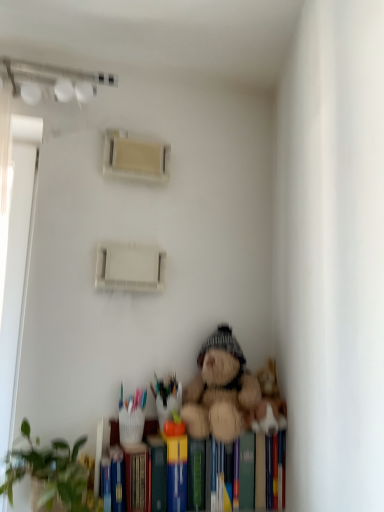
Question: Can you confirm if fuzzy brown teddy bear at lower center is bigger than hardcover book at lower center?

Choices:
 (A) yes
 (B) no

Answer: (A)

Question: From a real-world perspective, is fuzzy brown teddy bear at lower center physically below hardcover book at lower center?

Choices:
 (A) yes
 (B) no

Answer: (B)

Question: Is the surface of fuzzy brown teddy bear at lower center in direct contact with hardcover book at lower center?

Choices:
 (A) no
 (B) yes

Answer: (A)

Question: Is fuzzy brown teddy bear at lower center facing away from hardcover book at lower center?

Choices:
 (A) no
 (B) yes

Answer: (A)

Question: Is fuzzy brown teddy bear at lower center facing towards hardcover book at lower center?

Choices:
 (A) no
 (B) yes

Answer: (A)

Question: From a real-world perspective, is fuzzy brown teddy bear at lower center above or below hardcover book at lower center?

Choices:
 (A) above
 (B) below

Answer: (A)

Question: In terms of width, does fuzzy brown teddy bear at lower center look wider or thinner when compared to hardcover book at lower center?

Choices:
 (A) wide
 (B) thin

Answer: (A)

Question: Is fuzzy brown teddy bear at lower center in front of or behind hardcover book at lower center in the image?

Choices:
 (A) behind
 (B) front

Answer: (B)

Question: Based on their positions, is fuzzy brown teddy bear at lower center located to the left or right of hardcover book at lower center?

Choices:
 (A) left
 (B) right

Answer: (B)

Question: Is green matte plant at lower left wider or thinner than hardcover book at lower center?

Choices:
 (A) thin
 (B) wide

Answer: (B)

Question: Relative to hardcover book at lower center, is green matte plant at lower left in front or behind?

Choices:
 (A) front
 (B) behind

Answer: (A)

Question: Does point (19, 478) appear closer or farther from the camera than point (112, 456)?

Choices:
 (A) closer
 (B) farther

Answer: (B)

Question: From their relative heights in the image, would you say green matte plant at lower left is taller or shorter than hardcover book at lower center?

Choices:
 (A) tall
 (B) short

Answer: (A)

Question: Is green matte plant at lower left in front of or behind fuzzy brown teddy bear at lower center in the image?

Choices:
 (A) behind
 (B) front

Answer: (B)

Question: From a real-world perspective, is green matte plant at lower left physically located above or below fuzzy brown teddy bear at lower center?

Choices:
 (A) above
 (B) below

Answer: (B)